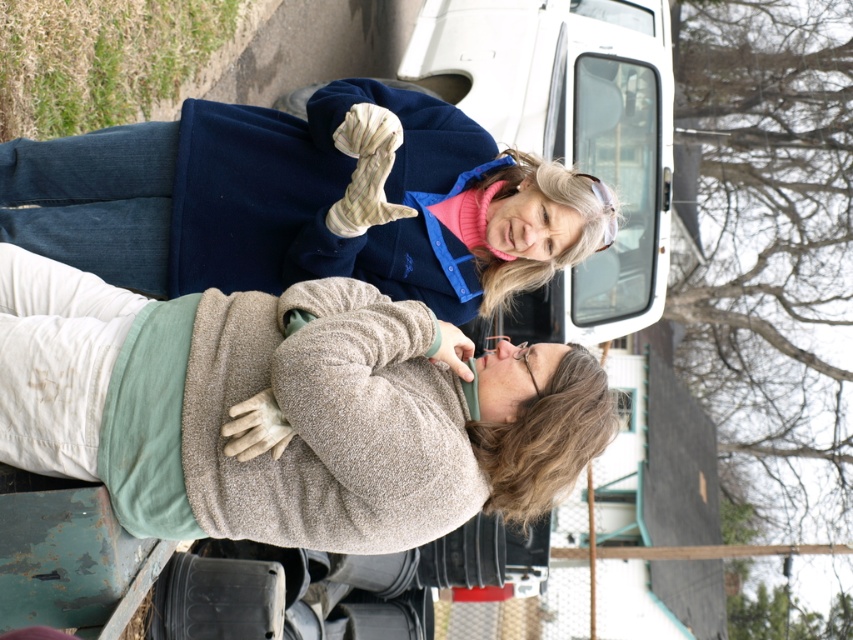
Question: Is beige fleece sweater at upper center positioned in front of blue fleece jacket at upper center?

Choices:
 (A) yes
 (B) no

Answer: (A)

Question: Does beige fleece sweater at upper center have a larger size compared to white matte van at upper center?

Choices:
 (A) yes
 (B) no

Answer: (B)

Question: Considering the real-world distances, which object is farthest from the white matte van at upper center?

Choices:
 (A) beige fleece sweater at upper center
 (B) blue fleece jacket at upper center

Answer: (A)

Question: Which point is closer to the camera?

Choices:
 (A) (466, 84)
 (B) (184, 211)

Answer: (B)

Question: Does beige fleece sweater at upper center have a lesser width compared to white matte van at upper center?

Choices:
 (A) yes
 (B) no

Answer: (A)

Question: Which point is closer to the camera taking this photo?

Choices:
 (A) (78, 340)
 (B) (473, 244)
 (C) (514, 97)

Answer: (A)